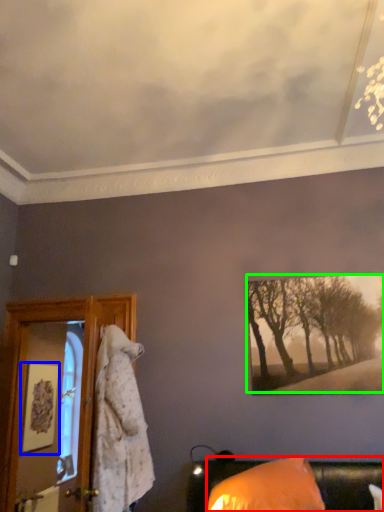
Question: Considering the real-world distances, which object is closest to furniture (highlighted by a red box)? picture frame (highlighted by a blue box) or tree (highlighted by a green box).

Choices:
 (A) picture frame
 (B) tree

Answer: (B)